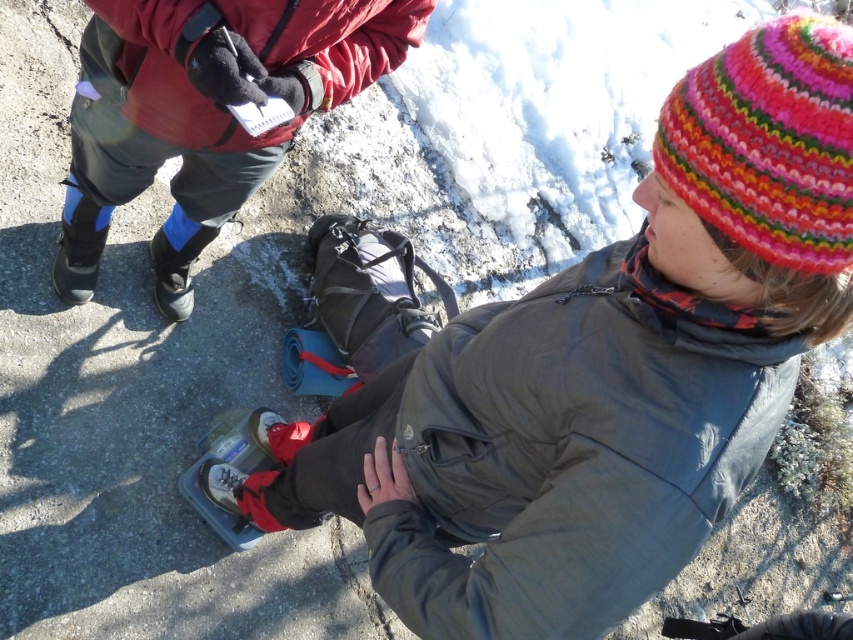
Question: Does matte red jacket at upper left have a smaller size compared to matte blue ski boot at lower left?

Choices:
 (A) yes
 (B) no

Answer: (B)

Question: Estimate the real-world distances between objects in this image. Which object is farther from the red fleece jacket at upper left?

Choices:
 (A) black rubber ski boot at upper left
 (B) matte blue ski boot at lower left

Answer: (B)

Question: Does matte red jacket at upper left appear under black rubber ski boot at upper left?

Choices:
 (A) no
 (B) yes

Answer: (A)

Question: Estimate the real-world distances between objects in this image. Which object is closer to the knitted woolen hat at upper right?

Choices:
 (A) matte red jacket at upper left
 (B) red fleece jacket at upper left
 (C) black rubber ski boot at upper left
 (D) matte blue ski boot at lower left

Answer: (B)

Question: Does knitted woolen hat at upper right appear under black rubber ski boot at upper left?

Choices:
 (A) no
 (B) yes

Answer: (B)

Question: Among these objects, which one is nearest to the camera?

Choices:
 (A) red fleece jacket at upper left
 (B) matte blue ski boot at lower left
 (C) knitted woolen hat at upper right

Answer: (C)